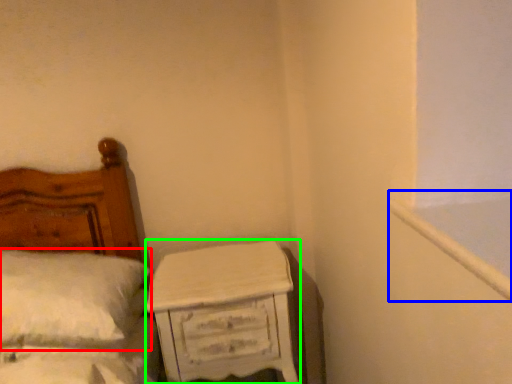
Question: Considering the real-world distances, which object is closest to pillow (highlighted by a red box)? window frame (highlighted by a blue box) or nightstand (highlighted by a green box).

Choices:
 (A) window frame
 (B) nightstand

Answer: (B)